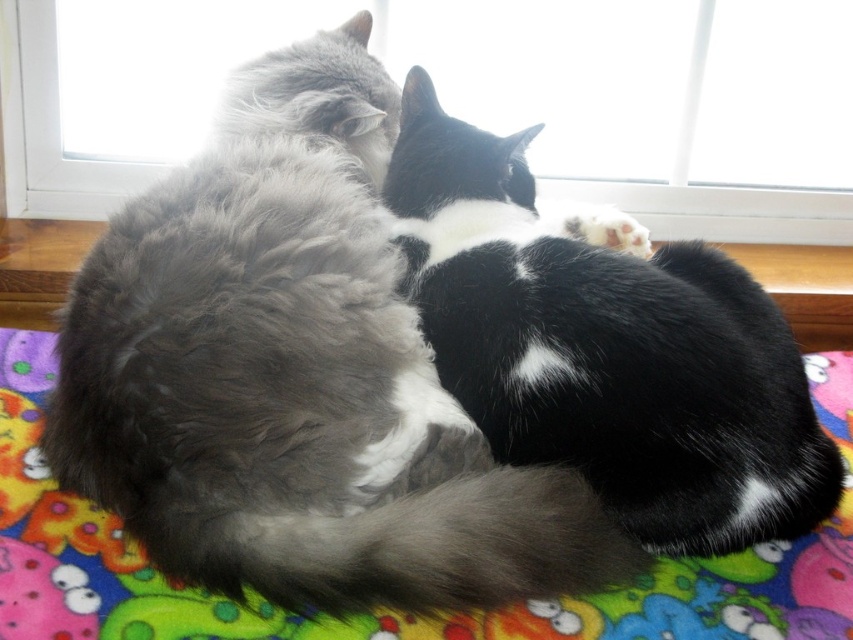
Question: Among these objects, which one is farthest from the camera?

Choices:
 (A) fluffy gray cat at center
 (B) wooden window sill at center

Answer: (B)

Question: Is black and white fur cat at center thinner than multicolored fleece blanket at center?

Choices:
 (A) no
 (B) yes

Answer: (B)

Question: Is fluffy gray cat at center above transparent glass window at upper center?

Choices:
 (A) yes
 (B) no

Answer: (B)

Question: Can you confirm if transparent glass window at upper center is smaller than wooden window sill at center?

Choices:
 (A) no
 (B) yes

Answer: (A)

Question: Which point is closer to the camera?

Choices:
 (A) (62, 234)
 (B) (560, 131)
 (C) (682, 577)

Answer: (C)

Question: Which point is farther from the camera taking this photo?

Choices:
 (A) (846, 272)
 (B) (13, 592)
 (C) (498, 404)

Answer: (A)